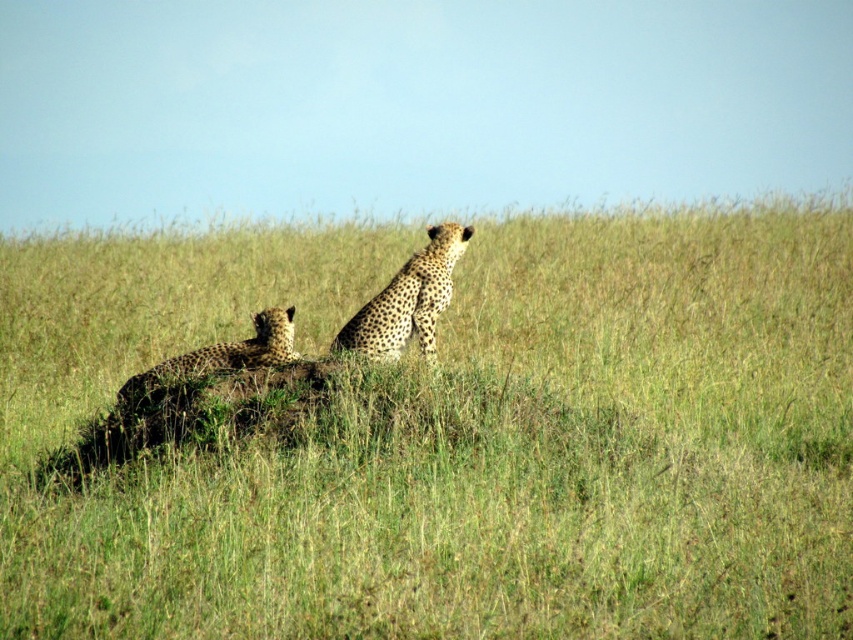
Does green grass at center appear on the left side of spotted fur cheetah at lower left?

Incorrect, green grass at center is not on the left side of spotted fur cheetah at lower left.

Which of these two, green grass at center or spotted fur cheetah at lower left, stands taller?

green grass at center is taller.

Where is `green grass at center`? green grass at center is located at coordinates (451, 435).

The height and width of the screenshot is (640, 853). I want to click on green grass at center, so click(x=451, y=435).

Does green grass at center lie in front of spotted fur cheetah at center?

Yes, it is in front of spotted fur cheetah at center.

Does point (115, 365) lie behind point (434, 268)?

Yes.

Identify the location of green grass at center. (451, 435).

Can you confirm if spotted fur cheetah at center is taller than spotted fur cheetah at lower left?

Yes.

Who is shorter, spotted fur cheetah at center or spotted fur cheetah at lower left?

spotted fur cheetah at lower left is shorter.

Is point (418, 259) closer to viewer compared to point (137, 388)?

No, it is not.

Where is `spotted fur cheetah at center`? spotted fur cheetah at center is located at coordinates (408, 300).